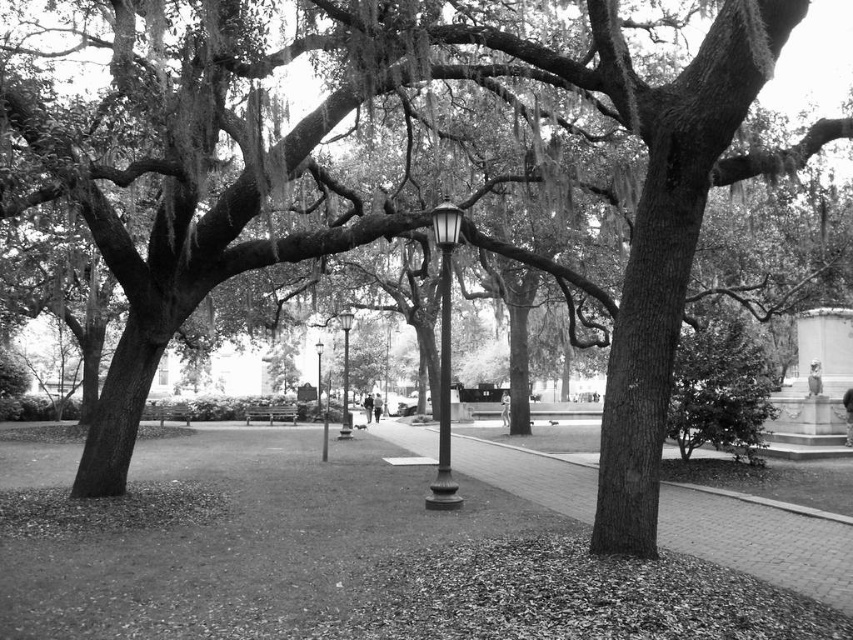
You are a park visitor who wants to sit down for a moment. You see the polished metal lamp post at center and the wooden bench at center. Which object is bigger and therefore might block your path if you try to walk towards the bench?

The polished metal lamp post at center is larger in size than the wooden bench at center, so it might block your path if you try to walk towards the bench.

You are a park visitor who wants to sit down and rest. You see a wooden bench at center and a metallic lamp post at center. Which object is smaller and therefore more suitable for sitting?

The wooden bench at center is smaller than the metallic lamp post at center, so it is more suitable for sitting.

Based on the coordinates provided in the scene description, where is the brick pavement at center located in the image?

The brick pavement at center is located at point (761, 540) in the image.